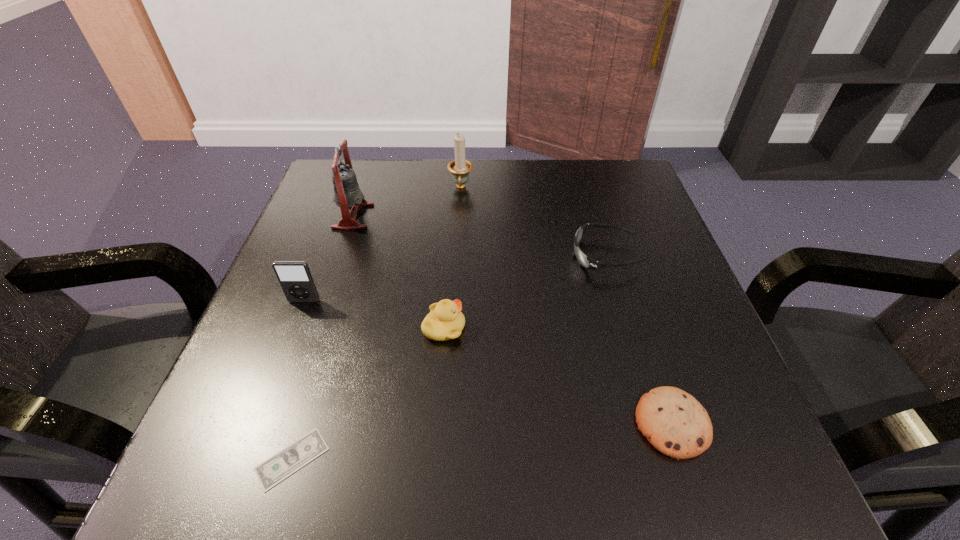
Where is `object located at the far left corner`? The image size is (960, 540). object located at the far left corner is located at coordinates (347, 193).

At what (x,y) coordinates should I click in order to perform the action: click on object at the near left corner. Please return your answer as a coordinate pair (x, y). Image resolution: width=960 pixels, height=540 pixels. Looking at the image, I should click on (278, 467).

The image size is (960, 540). In order to click on object positioned at the near right corner in this screenshot , I will do pos(674,422).

You are a GUI agent. You are given a task and a screenshot of the screen. Output one action in this format:
    pyautogui.click(x=<x>, y=<y>)
    Task: Click on the free location at the far edge of the desktop
    
    Given the screenshot: What is the action you would take?
    pyautogui.click(x=520, y=172)

Find the location of `free space at the near edge of the desktop`. free space at the near edge of the desktop is located at coordinates (539, 478).

What are the coordinates of `free space at the left edge of the desktop` in the screenshot? It's located at (250, 335).

The image size is (960, 540). Find the location of `vacant area at the right edge`. vacant area at the right edge is located at coordinates (652, 317).

I want to click on vacant point at the far left corner, so click(x=317, y=198).

The height and width of the screenshot is (540, 960). In order to click on blank area at the near left corner in this screenshot , I will do pyautogui.click(x=246, y=465).

In the image, there is a desktop. Identify the location of vacant area at the far right corner. The image size is (960, 540). (585, 199).